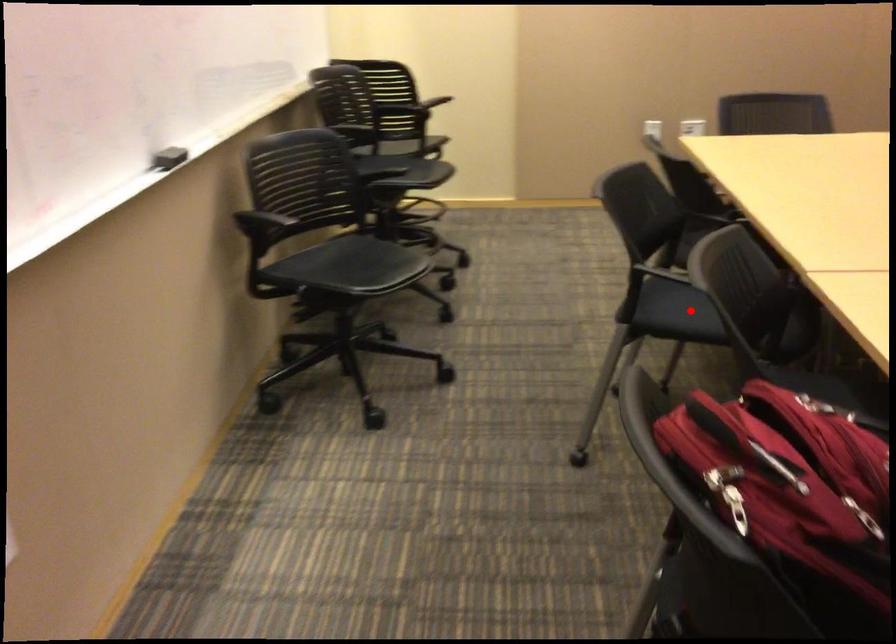
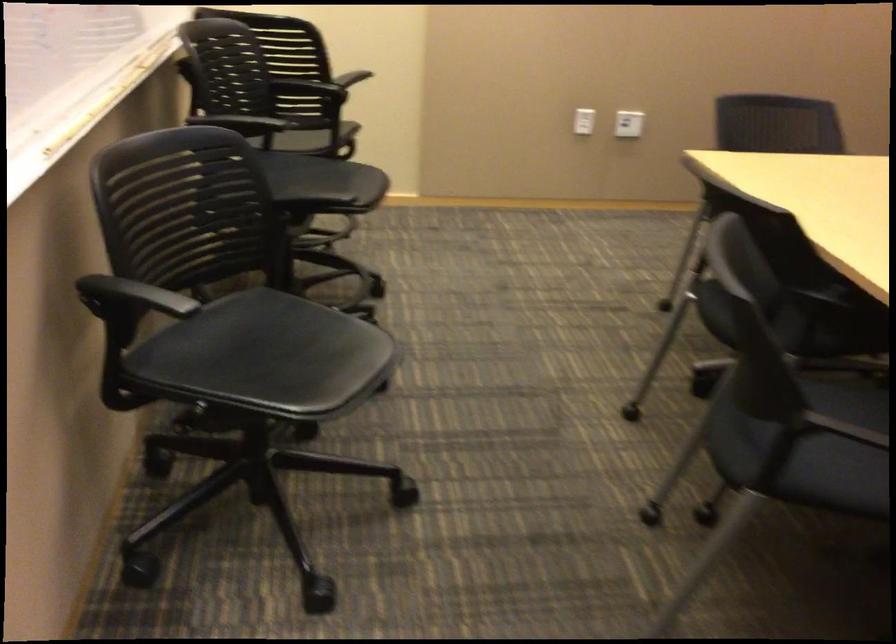
Locate, in the second image, the point that corresponds to the highlighted location in the first image.

(804, 442)